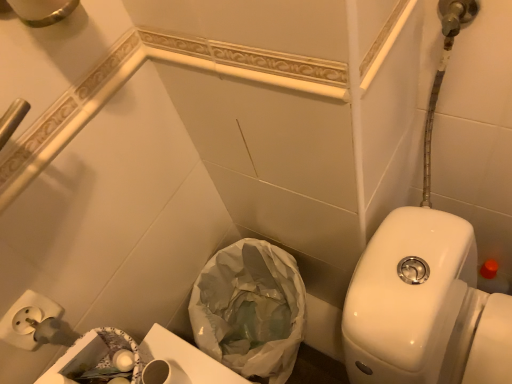
The height and width of the screenshot is (384, 512). What do you see at coordinates (250, 310) in the screenshot?
I see `white plastic bag at lower center` at bounding box center [250, 310].

Find the location of a particular element. white plastic bag at lower center is located at coordinates (250, 310).

What do you see at coordinates (424, 307) in the screenshot?
I see `white glossy toilet at right` at bounding box center [424, 307].

Where is `white glossy toilet at right`? This screenshot has width=512, height=384. white glossy toilet at right is located at coordinates (424, 307).

Identify the location of white plastic bag at lower center. This screenshot has height=384, width=512. (250, 310).

Considering the relative positions of white plastic bag at lower center and white glossy toilet at right in the image provided, is white plastic bag at lower center to the right of white glossy toilet at right from the viewer's perspective?

No.

In the image, is white plastic bag at lower center positioned in front of or behind white glossy toilet at right?

In the image, white plastic bag at lower center appears behind white glossy toilet at right.

Between point (203, 300) and point (500, 371), which one is positioned behind?

Positioned behind is point (203, 300).

From the image's perspective, which is below, white plastic bag at lower center or white glossy toilet at right?

white plastic bag at lower center, from the image's perspective.

From a real-world perspective, which object rests below the other?

In real-world perspective, white plastic bag at lower center is lower.

Considering the sizes of objects white plastic bag at lower center and white glossy toilet at right in the image provided, who is thinner, white plastic bag at lower center or white glossy toilet at right?

With smaller width is white plastic bag at lower center.

Considering the relative sizes of white plastic bag at lower center and white glossy toilet at right in the image provided, is white plastic bag at lower center taller than white glossy toilet at right?

Indeed, white plastic bag at lower center has a greater height compared to white glossy toilet at right.

Which of these two, white plastic bag at lower center or white glossy toilet at right, is bigger?

With larger size is white glossy toilet at right.

Based on the photo, would you say white plastic bag at lower center is outside white glossy toilet at right?

Yes, white plastic bag at lower center is not within white glossy toilet at right.

Are white plastic bag at lower center and white glossy toilet at right far apart?

white plastic bag at lower center is near white glossy toilet at right, not far away.

Is white plastic bag at lower center positioned with its back to white glossy toilet at right?

That's not correct — white plastic bag at lower center is not looking away from white glossy toilet at right.

How many degrees apart are the facing directions of white plastic bag at lower center and white glossy toilet at right?

1.7 degrees separate the facing orientations of white plastic bag at lower center and white glossy toilet at right.

This screenshot has height=384, width=512. I want to click on toilet that is on the right side of white plastic bag at lower center, so click(424, 307).

Considering the positions of objects white glossy toilet at right and white plastic bag at lower center in the image provided, who is more to the right, white glossy toilet at right or white plastic bag at lower center?

white glossy toilet at right is more to the right.

Which object is further away from the camera, white glossy toilet at right or white plastic bag at lower center?

Positioned behind is white plastic bag at lower center.

Is point (358, 356) closer or farther from the camera than point (200, 274)?

Point (358, 356).

In the scene shown: From the image's perspective, which object appears higher, white glossy toilet at right or white plastic bag at lower center?

white glossy toilet at right, from the image's perspective.

From a real-world perspective, is white glossy toilet at right below white plastic bag at lower center?

No.

Looking at their sizes, would you say white glossy toilet at right is wider or thinner than white plastic bag at lower center?

Considering their sizes, white glossy toilet at right looks broader than white plastic bag at lower center.

Can you confirm if white glossy toilet at right is shorter than white plastic bag at lower center?

Yes.

Who is bigger, white glossy toilet at right or white plastic bag at lower center?

Bigger between the two is white glossy toilet at right.

Can we say white glossy toilet at right lies outside white plastic bag at lower center?

Yes.

Is there a large distance between white glossy toilet at right and white plastic bag at lower center?

No, white glossy toilet at right is not far away from white plastic bag at lower center.

Is white glossy toilet at right aimed at white plastic bag at lower center?

No.

How distant is white glossy toilet at right from white plastic bag at lower center?

white glossy toilet at right is 13.63 inches from white plastic bag at lower center.

Find the location of a particular element. garbage located behind the white glossy toilet at right is located at coordinates (250, 310).

Find the location of `toilet that appears on the right of white plastic bag at lower center`. toilet that appears on the right of white plastic bag at lower center is located at coordinates (424, 307).

I want to click on toilet lying above the white plastic bag at lower center (from the image's perspective), so click(424, 307).